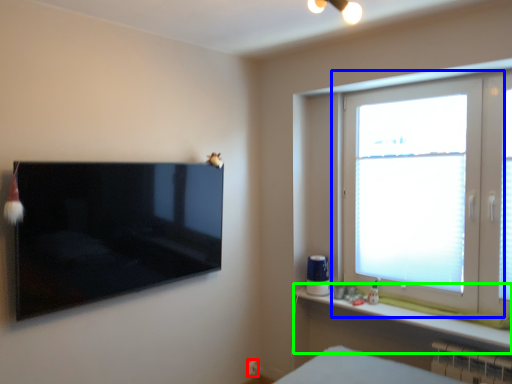
Question: Which object is the closest to the electric outlet (highlighted by a red box)? Choose among these: window (highlighted by a blue box) or window sill (highlighted by a green box).

Choices:
 (A) window
 (B) window sill

Answer: (B)